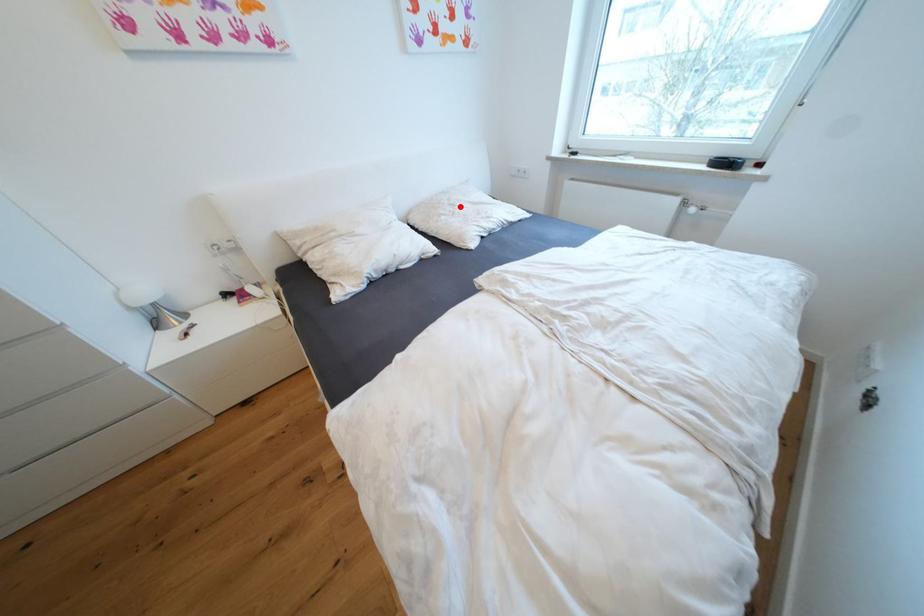
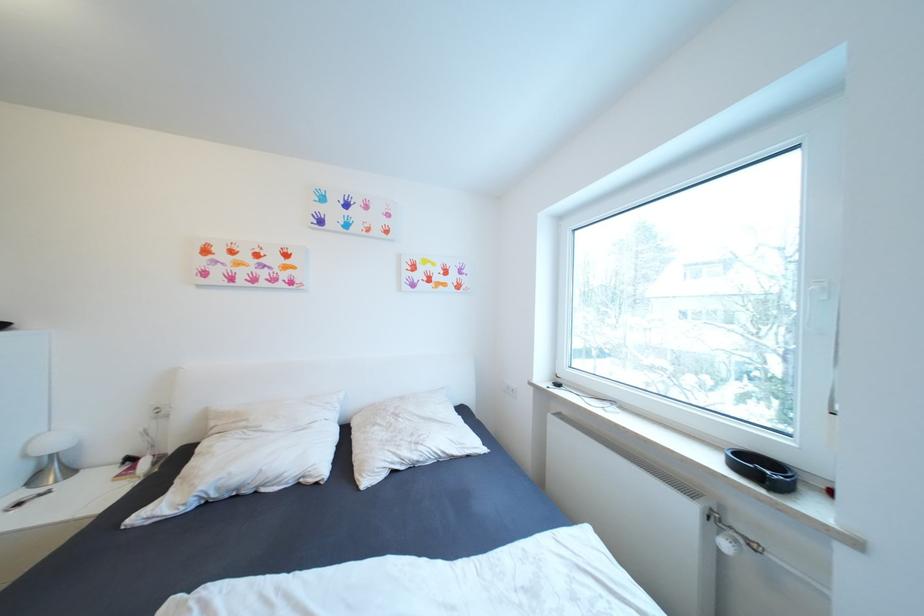
Question: I am providing you with two images of the same scene from different viewpoints. A red point is shown in image1. For the corresponding object point in image2, is it positioned nearer or farther from the camera?

Choices:
 (A) Nearer
 (B) Farther

Answer: (B)